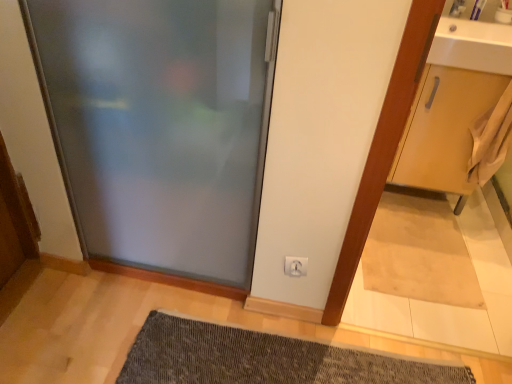
What is the approximate height of white glossy sink at upper right?

white glossy sink at upper right is 5.28 inches in height.

Find the location of `white glossy sink at upper right`. white glossy sink at upper right is located at coordinates click(x=473, y=46).

This screenshot has width=512, height=384. Describe the element at coordinates (295, 266) in the screenshot. I see `white plastic electric outlet at lower center` at that location.

Measure the distance between point [246,54] and camera.

The distance of point [246,54] from camera is 3.73 feet.

Where is `beige fabric doormat at lower right`? beige fabric doormat at lower right is located at coordinates (419, 251).

Considering the points (478, 66) and (252, 345), which point is in front, point (478, 66) or point (252, 345)?

The point (252, 345) is closer.

Is white glossy sink at upper right located outside dark gray textured bath mat at lower center?

Yes, white glossy sink at upper right is not within dark gray textured bath mat at lower center.

Does white glossy sink at upper right turn towards dark gray textured bath mat at lower center?

No, white glossy sink at upper right is not facing towards dark gray textured bath mat at lower center.

Can you confirm if white glossy sink at upper right is thinner than dark gray textured bath mat at lower center?

Correct, the width of white glossy sink at upper right is less than that of dark gray textured bath mat at lower center.

Could you tell me if frosted glass door at center is turned towards dark gray textured bath mat at lower center?

No, frosted glass door at center is not aimed at dark gray textured bath mat at lower center.

Which object is wider, frosted glass door at center or dark gray textured bath mat at lower center?

Wider between the two is dark gray textured bath mat at lower center.

From the image's perspective, which object appears higher, frosted glass door at center or dark gray textured bath mat at lower center?

frosted glass door at center.

Considering the points (94, 69) and (291, 357), which point is in front, point (94, 69) or point (291, 357)?

The point (94, 69) is in front.

From a real-world perspective, is frosted glass door at center above or below light brown wood cabinet at right?

From a real-world perspective, frosted glass door at center is physically above light brown wood cabinet at right.

Is point (234, 239) closer to camera compared to point (442, 74)?

Yes, it is.

Considering the sizes of objects frosted glass door at center and light brown wood cabinet at right in the image provided, who is bigger, frosted glass door at center or light brown wood cabinet at right?

frosted glass door at center.

Is dark gray textured bath mat at lower center positioned far away from beige fabric doormat at lower right?

No.

Does dark gray textured bath mat at lower center have a greater height compared to beige fabric doormat at lower right?

Indeed, dark gray textured bath mat at lower center has a greater height compared to beige fabric doormat at lower right.

Where is `bath mat on the left of beige fabric doormat at lower right`? The height and width of the screenshot is (384, 512). bath mat on the left of beige fabric doormat at lower right is located at coordinates (264, 358).

Considering the sizes of dark gray textured bath mat at lower center and beige fabric doormat at lower right in the image, is dark gray textured bath mat at lower center bigger or smaller than beige fabric doormat at lower right?

In the image, dark gray textured bath mat at lower center appears to be larger than beige fabric doormat at lower right.

Identify the location of cabinetry positioned vertically above the white plastic electric outlet at lower center (from a real-world perspective). The width and height of the screenshot is (512, 384). point(444,128).

Is white plastic electric outlet at lower center turned away from light brown wood cabinet at right?

No, white plastic electric outlet at lower center is not facing the opposite direction of light brown wood cabinet at right.

Which object is positioned more to the right, white plastic electric outlet at lower center or light brown wood cabinet at right?

light brown wood cabinet at right is more to the right.

Is beige fabric doormat at lower right at the back of frosted glass door at center?

No, beige fabric doormat at lower right is not at the back of frosted glass door at center.

How far apart are frosted glass door at center and beige fabric doormat at lower right?

frosted glass door at center is 1.06 meters from beige fabric doormat at lower right.

Which point is more forward, (218, 225) or (384, 278)?

The point (218, 225) is closer to the camera.

From the image's perspective, is frosted glass door at center above beige fabric doormat at lower right?

Correct, frosted glass door at center appears higher than beige fabric doormat at lower right in the image.

Could you measure the distance between dark gray textured bath mat at lower center and white plastic electric outlet at lower center?

They are 16.26 inches apart.

Is dark gray textured bath mat at lower center taller than white plastic electric outlet at lower center?

In fact, dark gray textured bath mat at lower center may be shorter than white plastic electric outlet at lower center.

Looking at this image, does dark gray textured bath mat at lower center lie in front of white plastic electric outlet at lower center?

Yes.

From the picture: From the image's perspective, is dark gray textured bath mat at lower center above or below white plastic electric outlet at lower center?

Based on their image positions, dark gray textured bath mat at lower center is located beneath white plastic electric outlet at lower center.

In the image, there is a white glossy sink at upper right. At what (x,y) coordinates should I click in order to perform the action: click on bath mat below it (from the image's perspective). Please return your answer as a coordinate pair (x, y). The height and width of the screenshot is (384, 512). Looking at the image, I should click on (264, 358).

Where is `door above the dark gray textured bath mat at lower center (from a real-world perspective)`? door above the dark gray textured bath mat at lower center (from a real-world perspective) is located at coordinates (160, 126).

Looking at the image, which one is located further to frosted glass door at center, white plastic electric outlet at lower center or white glossy sink at upper right?

Among the two, white glossy sink at upper right is located further to frosted glass door at center.

From the image, which object appears to be nearer to dark gray textured bath mat at lower center, light brown wood cabinet at right or beige fabric doormat at lower right?

The object closer to dark gray textured bath mat at lower center is beige fabric doormat at lower right.

From the image, which object appears to be farther from dark gray textured bath mat at lower center, beige fabric doormat at lower right or white plastic electric outlet at lower center?

beige fabric doormat at lower right lies further to dark gray textured bath mat at lower center than the other object.

Considering their positions, is white glossy sink at upper right positioned further to frosted glass door at center than white plastic electric outlet at lower center?

white glossy sink at upper right is positioned further to the anchor frosted glass door at center.

When comparing their distances from frosted glass door at center, does beige fabric doormat at lower right or dark gray textured bath mat at lower center seem closer?

dark gray textured bath mat at lower center lies closer to frosted glass door at center than the other object.

Estimate the real-world distances between objects in this image. Which object is closer to beige fabric doormat at lower right, white glossy sink at upper right or light brown wood cabinet at right?

The object closer to beige fabric doormat at lower right is light brown wood cabinet at right.

Considering their positions, is white glossy sink at upper right positioned further to beige fabric doormat at lower right than frosted glass door at center?

Based on the image, frosted glass door at center appears to be further to beige fabric doormat at lower right.

Which object lies further to the anchor point white plastic electric outlet at lower center, frosted glass door at center or beige fabric doormat at lower right?

beige fabric doormat at lower right is positioned further to the anchor white plastic electric outlet at lower center.

What are the coordinates of `bath mat between frosted glass door at center and light brown wood cabinet at right in the horizontal direction` in the screenshot? It's located at (264, 358).

The height and width of the screenshot is (384, 512). In order to click on doormat situated between frosted glass door at center and light brown wood cabinet at right from left to right in this screenshot , I will do `click(419, 251)`.

Where is `cabinetry located between frosted glass door at center and white glossy sink at upper right in the left-right direction`? Image resolution: width=512 pixels, height=384 pixels. cabinetry located between frosted glass door at center and white glossy sink at upper right in the left-right direction is located at coordinates (444, 128).

The image size is (512, 384). Find the location of `electric outlet between frosted glass door at center and dark gray textured bath mat at lower center vertically`. electric outlet between frosted glass door at center and dark gray textured bath mat at lower center vertically is located at coordinates (295, 266).